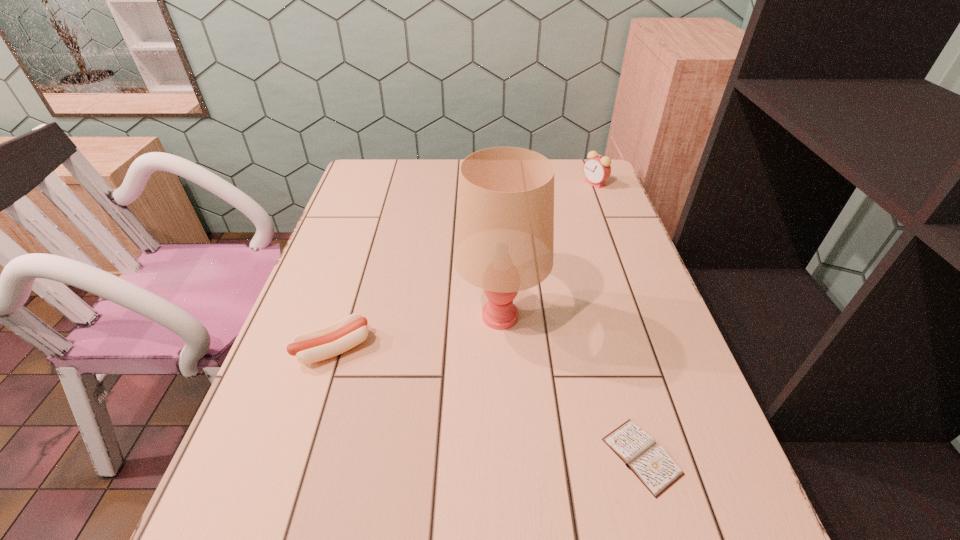
Where is `object that can be found as the closest to the farthest object`? The width and height of the screenshot is (960, 540). object that can be found as the closest to the farthest object is located at coordinates (504, 238).

Select which object appears as the third closest to the third shortest object. Please provide its 2D coordinates. Your answer should be formatted as a tuple, i.e. [(x, y)], where the tuple contains the x and y coordinates of a point satisfying the conditions above.

[(337, 338)]

The image size is (960, 540). Find the location of `free spot that satisfies the following two spatial constraints: 1. on the face of the third shortest object; 2. on the front side of the leftmost object`. free spot that satisfies the following two spatial constraints: 1. on the face of the third shortest object; 2. on the front side of the leftmost object is located at coordinates (657, 348).

You are a GUI agent. You are given a task and a screenshot of the screen. Output one action in this format:
    pyautogui.click(x=<x>, y=<y>)
    Task: Click on the free location that satisfies the following two spatial constraints: 1. on the face of the second tallest object; 2. on the front side of the tallest object
    The image size is (960, 540).
    Given the screenshot: What is the action you would take?
    pyautogui.click(x=644, y=315)

You are a GUI agent. You are given a task and a screenshot of the screen. Output one action in this format:
    pyautogui.click(x=<x>, y=<y>)
    Task: Click on the free space that satisfies the following two spatial constraints: 1. on the back side of the leftmost object; 2. on the right side of the tallest object
    This screenshot has height=540, width=960.
    Given the screenshot: What is the action you would take?
    pyautogui.click(x=345, y=315)

This screenshot has width=960, height=540. In order to click on free location that satisfies the following two spatial constraints: 1. on the face of the farthest object; 2. on the front side of the tallest object in this screenshot , I will do `click(644, 315)`.

This screenshot has width=960, height=540. What are the coordinates of `free location that satisfies the following two spatial constraints: 1. on the face of the farthest object; 2. on the front side of the lampshade` in the screenshot? It's located at (644, 315).